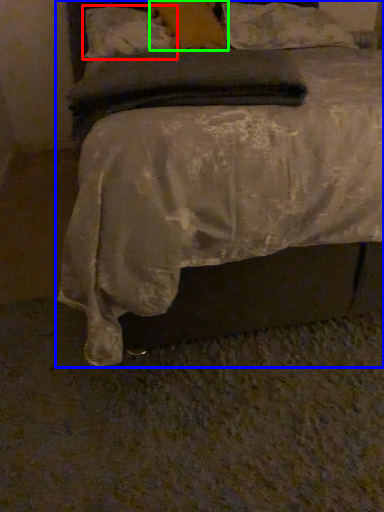
Question: Which object is positioned closest to pillow (highlighted by a red box)? Select from bed (highlighted by a blue box) and pillow (highlighted by a green box).

Choices:
 (A) bed
 (B) pillow

Answer: (B)